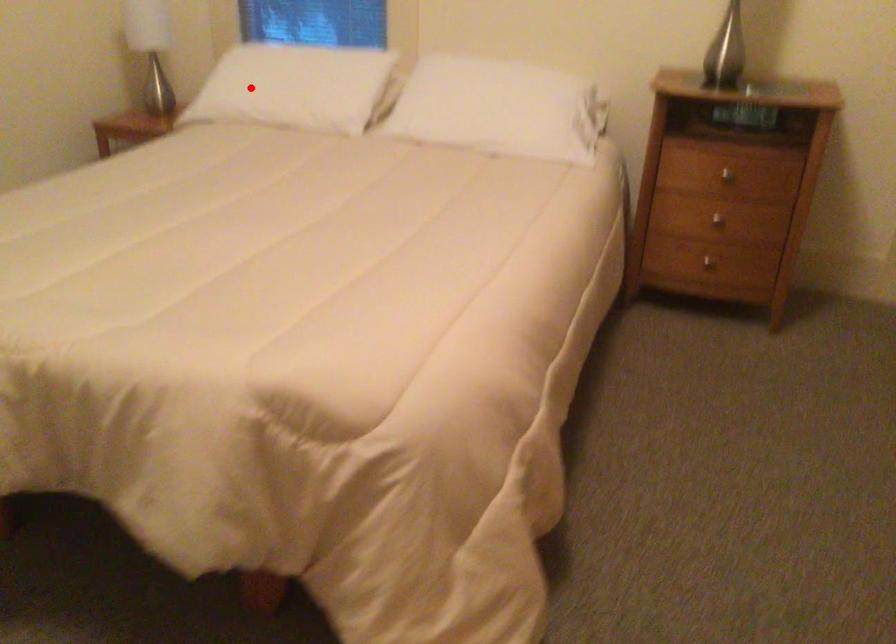
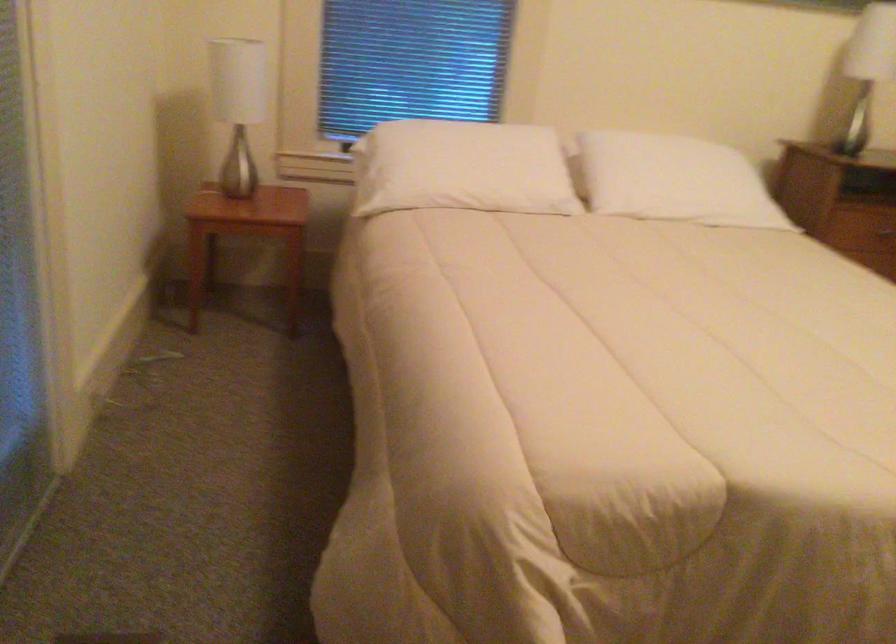
Question: I am providing you with two images of the same scene from different viewpoints. In image1, a red point is highlighted. Considering the same 3D point in image2, which of the following is correct?

Choices:
 (A) It is closer
 (B) It is farther

Answer: (A)